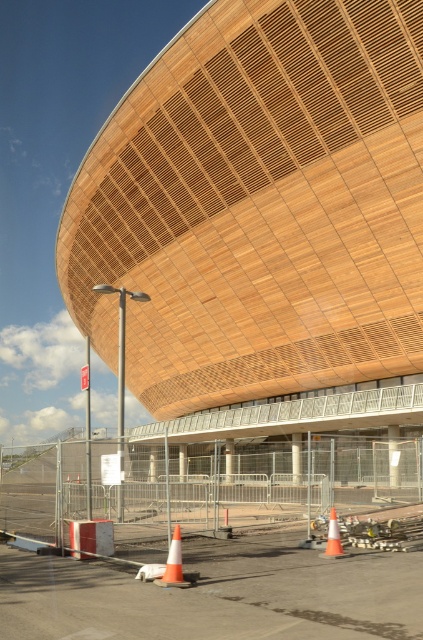
You are standing at the construction site and want to determine the relative positions of two points marked on the blueprint. The first point is labeled as point (169, 580), and the second is point (331, 545). Based on the image provided, which point is closer to your current position?

Point (169, 580) is closer to the viewer than point (331, 545).

You are a delivery truck driver who needs to park your truck, which is 12 feet long, in the area between the smooth asphalt tarmac at lower center and the orange reflective cone at lower center. Can you safely park your truck there without hitting either object?

The distance between the smooth asphalt tarmac at lower center and the orange reflective cone at lower center is 8.57 feet. Since your truck is 12 feet long, it is longer than the available space between them. Therefore, you cannot safely park your truck there without overlapping the tarmac or the cone.